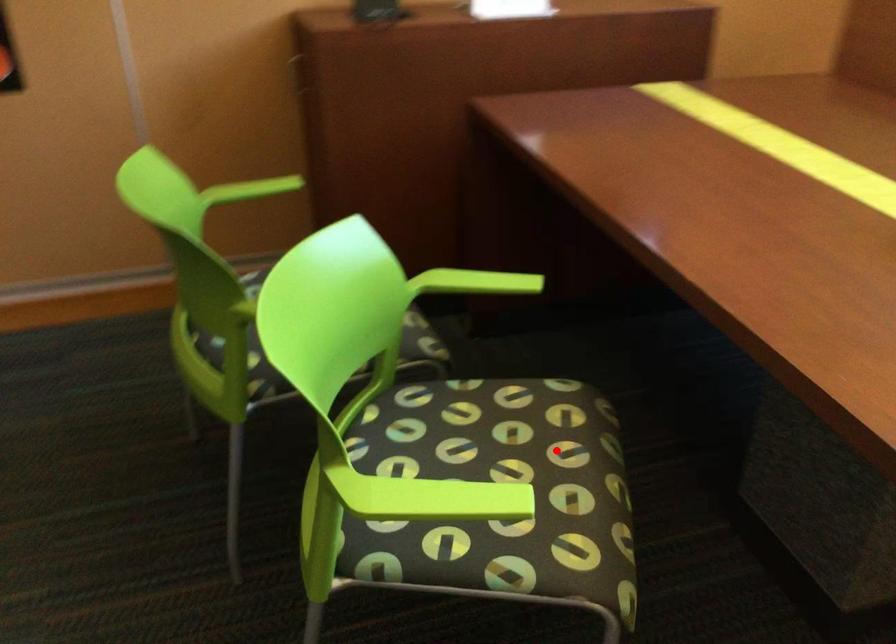
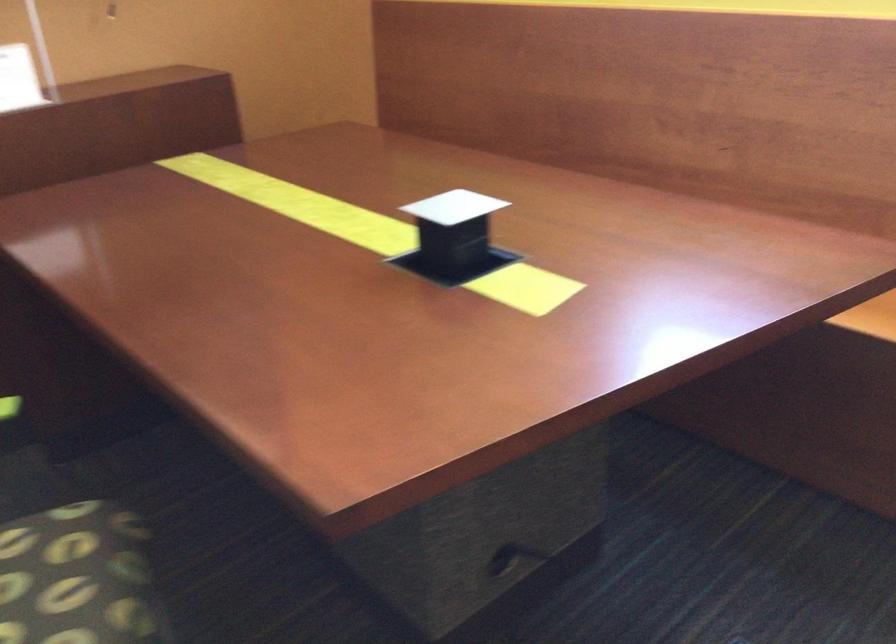
Question: I am providing you with two images of the same scene from different viewpoints. In image1, a red point is highlighted. Considering the same 3D point in image2, which of the following is correct?

Choices:
 (A) It is closer
 (B) It is farther

Answer: (A)